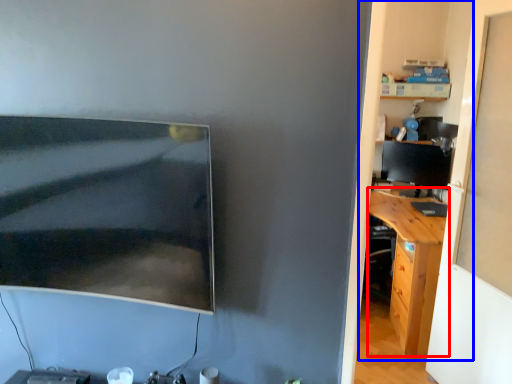
Question: Which object appears farthest to the camera in this image, desk (highlighted by a red box) or dresser (highlighted by a blue box)?

Choices:
 (A) desk
 (B) dresser

Answer: (A)